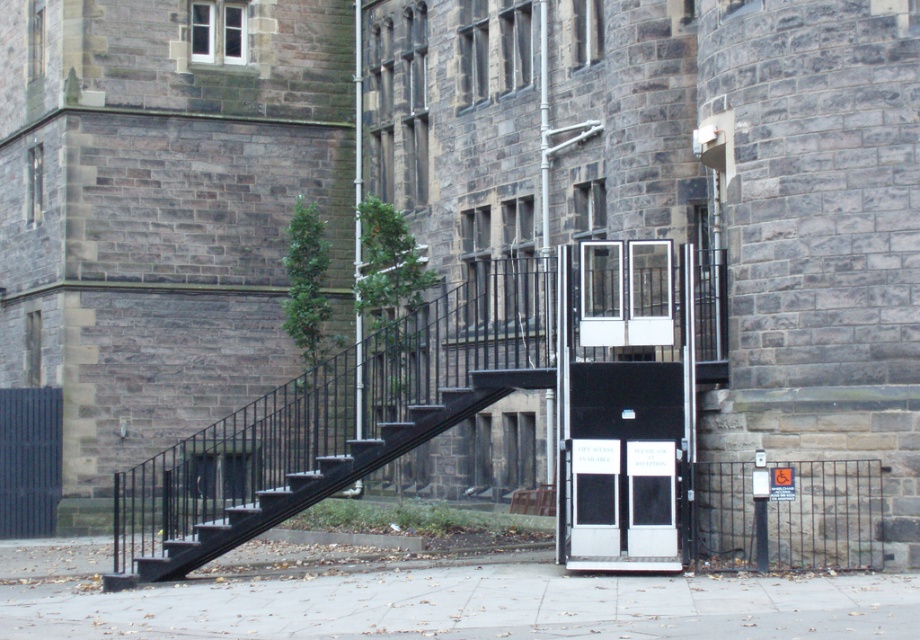
Question: Which is farther from the black metal stairwell at lower left?

Choices:
 (A) black matte door at center
 (B) smooth concrete pavement at center

Answer: (B)

Question: Based on their relative distances, which object is farther from the dark gray stone tower at left?

Choices:
 (A) black metal stairwell at lower left
 (B) smooth concrete pavement at center

Answer: (A)

Question: Is black matte door at center smaller than black metal stairwell at lower left?

Choices:
 (A) yes
 (B) no

Answer: (A)

Question: Does smooth concrete pavement at center have a lesser width compared to black metal stairwell at lower left?

Choices:
 (A) yes
 (B) no

Answer: (B)

Question: Which object is farther from the camera taking this photo?

Choices:
 (A) black matte door at center
 (B) dark gray stone tower at left

Answer: (B)

Question: Can you confirm if smooth concrete pavement at center is wider than black metal stairwell at lower left?

Choices:
 (A) yes
 (B) no

Answer: (A)